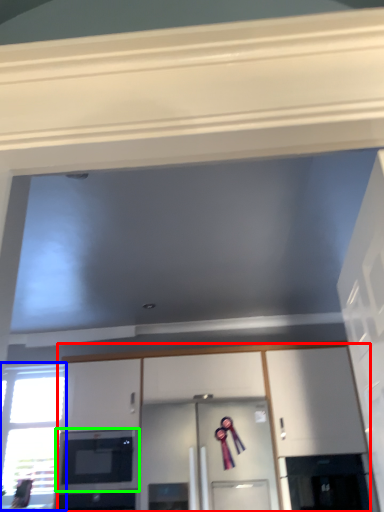
Question: Considering the real-world distances, which object is farthest from cabinetry (highlighted by a red box)? window (highlighted by a blue box) or microwave oven (highlighted by a green box)?

Choices:
 (A) window
 (B) microwave oven

Answer: (A)